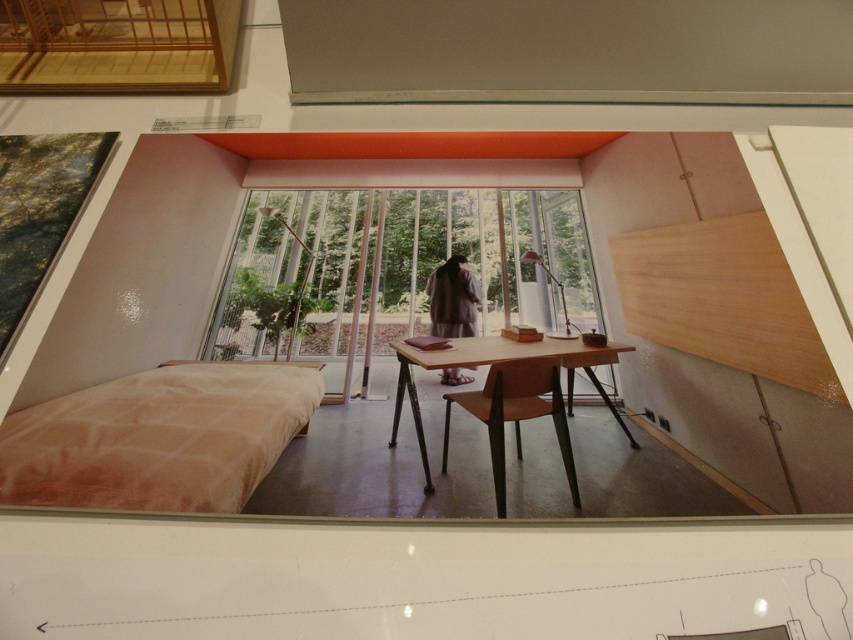
Question: Is transparent glass door at center thinner than wooden table at center?

Choices:
 (A) no
 (B) yes

Answer: (A)

Question: Among these objects, which one is nearest to the camera?

Choices:
 (A) transparent glass door at center
 (B) wooden table at center
 (C) satin beige bed at lower left
 (D) wooden chair at center

Answer: (C)

Question: Which object is closer to the camera taking this photo?

Choices:
 (A) wooden chair at center
 (B) transparent glass door at center

Answer: (A)

Question: Is wooden chair at center closer to the viewer compared to wooden table at center?

Choices:
 (A) no
 (B) yes

Answer: (B)

Question: Can you confirm if wooden chair at center is wider than wooden table at center?

Choices:
 (A) no
 (B) yes

Answer: (A)

Question: Among these points, which one is nearest to the camera?

Choices:
 (A) (477, 416)
 (B) (306, 392)

Answer: (A)